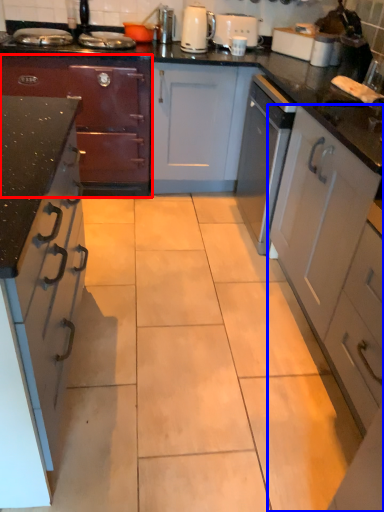
Question: Which object is further to the camera taking this photo, cabinetry (highlighted by a red box) or cabinetry (highlighted by a blue box)?

Choices:
 (A) cabinetry
 (B) cabinetry

Answer: (A)